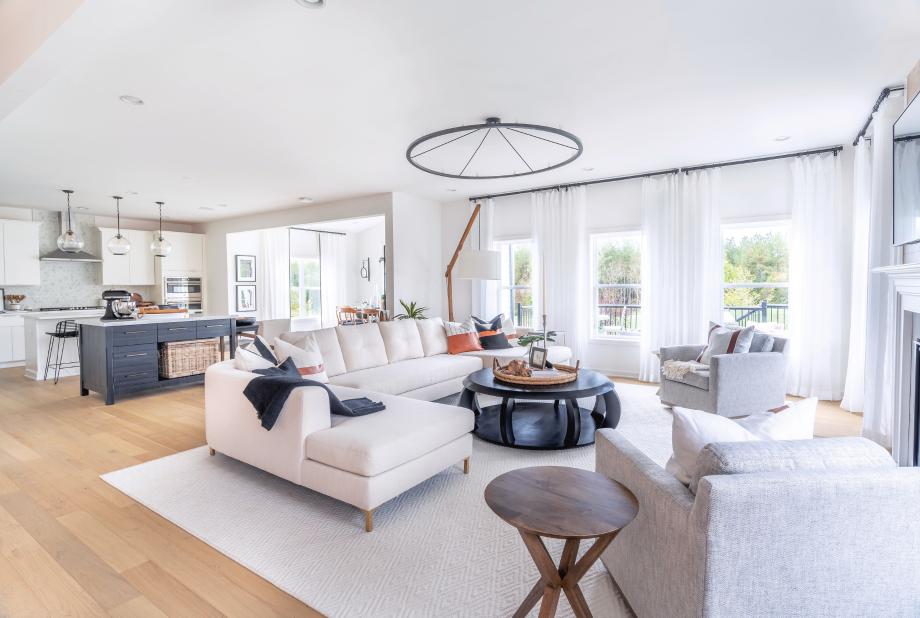
This screenshot has width=920, height=618. I want to click on bar stool, so click(x=63, y=329).